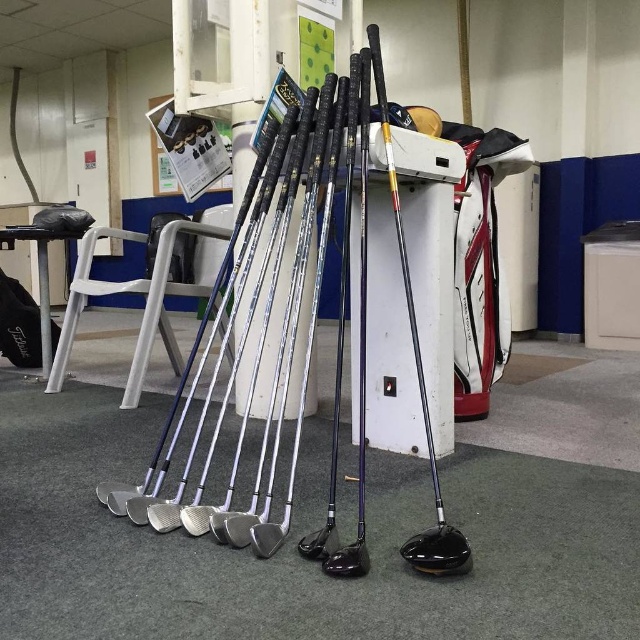
Question: Based on their relative distances, which object is nearer to the shiny black golf club at center?

Choices:
 (A) black rubber golf club at center
 (B) black plastic stool at lower left

Answer: (A)

Question: Is shiny black golf club at center above black rubber golf club at center?

Choices:
 (A) no
 (B) yes

Answer: (B)

Question: Does shiny black golf club at center appear on the left side of black rubber golf club at center?

Choices:
 (A) no
 (B) yes

Answer: (A)

Question: Can you confirm if shiny black golf club at center is positioned to the right of black plastic stool at lower left?

Choices:
 (A) no
 (B) yes

Answer: (B)

Question: Estimate the real-world distances between objects in this image. Which object is closer to the black rubber golf club at center?

Choices:
 (A) shiny black golf club at center
 (B) black plastic stool at lower left

Answer: (A)

Question: Which point is farther to the camera?

Choices:
 (A) shiny black golf club at center
 (B) black plastic stool at lower left

Answer: (B)